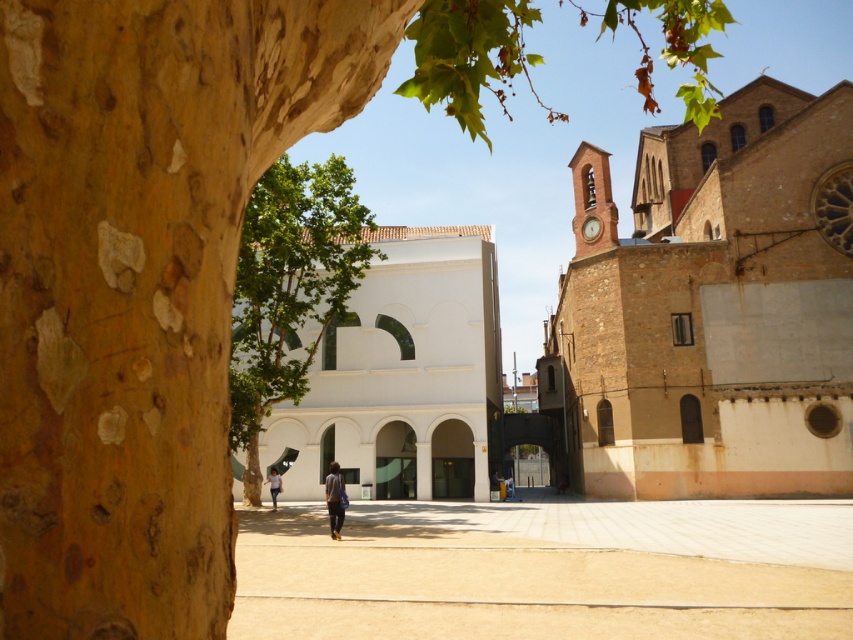
You are an architect analyzing the urban layout. Based on the scene, which structure occupies more space in the image, the brown brick church at upper right or the white smooth building at center?

The brown brick church at upper right is bigger than the white smooth building at center, so it occupies more space in the image.

You are a photographer planning to take a picture of the white smooth building at center and the denim jacket at center. You want to ensure both are fully visible in the frame. Which object should you adjust your camera focus on to capture the entire width of both objects?

The white smooth building at center has a larger width than the denim jacket at center, so you should focus on the white smooth building at center to ensure its entire width is captured, which will also include the denim jacket at center in the frame.

You are a photographer standing in the middle of the scene. You want to take a picture of the brown brick church at upper right without the denim jacket at center blocking the view. Is the church visible in your current position?

The brown brick church at upper right is positioned over the denim jacket at center, so the church is partially or fully hidden by the jacket in your current position. Move to a different angle to capture the church without obstruction.